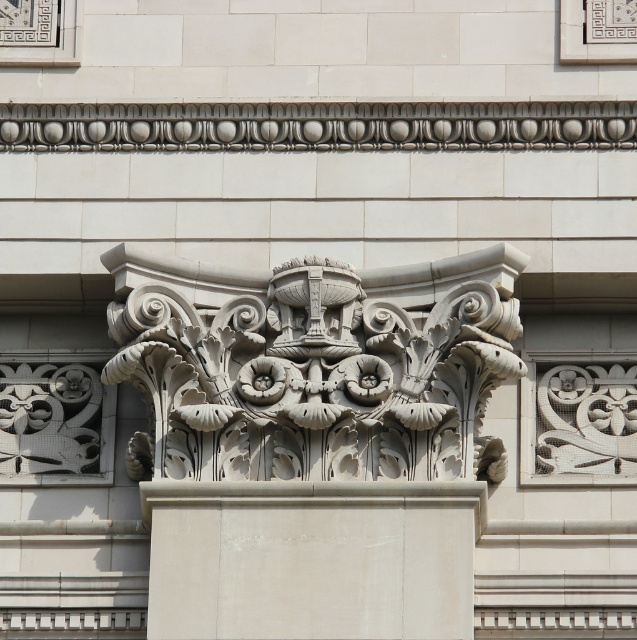
What do you see at coordinates (317, 365) in the screenshot? This screenshot has width=637, height=640. I see `white stone column capital at center` at bounding box center [317, 365].

Is white stone column capital at center closer to camera compared to white stone column at center?

No, it is not.

Is point (505, 275) less distant than point (461, 490)?

No, it is not.

Where is `white stone column capital at center`? white stone column capital at center is located at coordinates (317, 365).